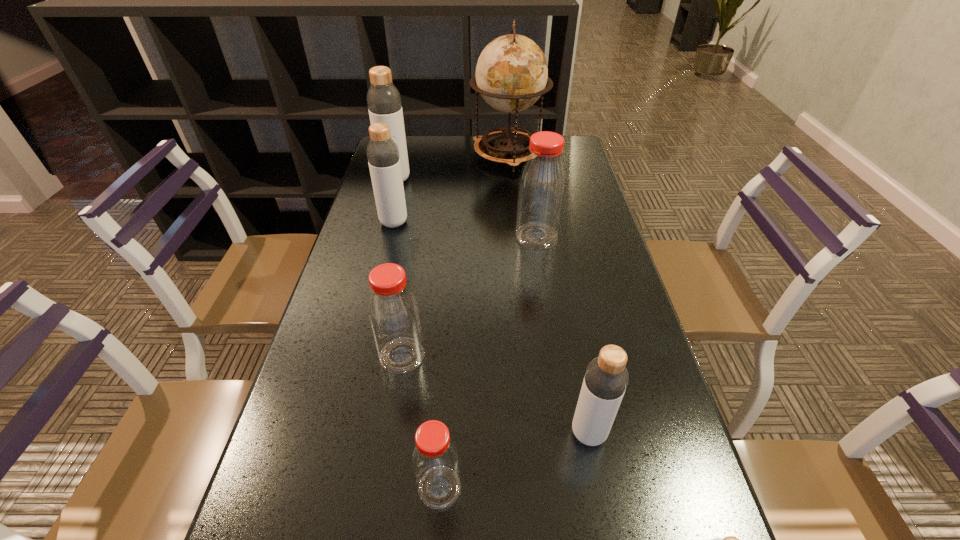
This screenshot has height=540, width=960. What are the coordinates of `the smallest red bottle` in the screenshot? It's located at (435, 459).

Locate an element on the screen. This screenshot has width=960, height=540. the second red bottle from left to right is located at coordinates (435, 459).

At what (x,y) coordinates should I click in order to perform the action: click on vacant region located at the center of the globe. Please return your answer as a coordinate pair (x, y). Looking at the image, I should click on (516, 245).

The image size is (960, 540). I want to click on vacant space situated 0.120m on the back of the farthest gray bottle, so click(402, 156).

Identify the location of vacant space located 0.270m on the back of the third nearest gray bottle. The width and height of the screenshot is (960, 540). (407, 170).

I want to click on vacant space located 0.090m on the left of the farthest red bottle, so click(484, 237).

Identify the location of blank space located 0.320m on the back of the leftmost red bottle. This screenshot has height=540, width=960. (420, 248).

Find the location of a particular element. Image resolution: width=960 pixels, height=540 pixels. free space located on the back of the sixth farthest object is located at coordinates (578, 377).

Where is `free space located 0.270m on the left of the nearest red bottle`? Image resolution: width=960 pixels, height=540 pixels. free space located 0.270m on the left of the nearest red bottle is located at coordinates (260, 488).

Where is `object located at the far edge`? object located at the far edge is located at coordinates (511, 74).